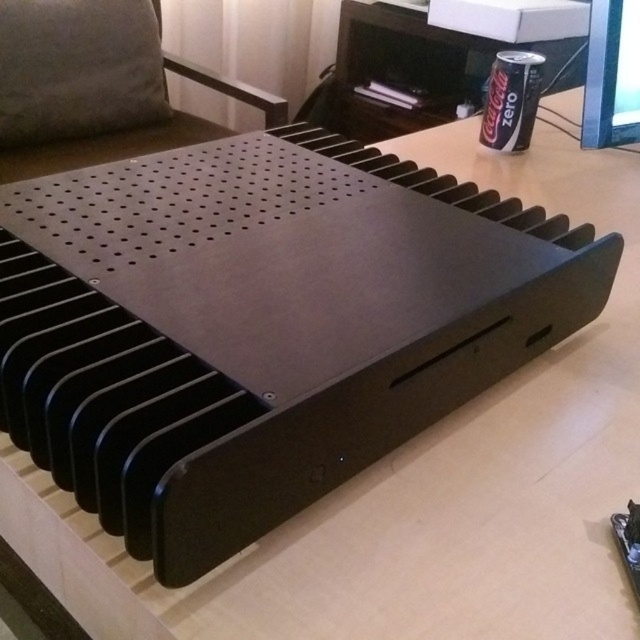
From the picture: Between black matte metal object at center and black matte can at upper right, which one appears on the right side from the viewer's perspective?

From the viewer's perspective, black matte can at upper right appears more on the right side.

Between point (134, 148) and point (532, 102), which one is positioned in front?

Point (532, 102)

The width and height of the screenshot is (640, 640). I want to click on black matte metal object at center, so click(x=100, y=140).

Consider the image. Who is shorter, metallic silver monitor at upper right or black matte can at upper right?

black matte can at upper right

Is point (628, 20) in front of point (496, 145)?

Yes, point (628, 20) is closer to viewer.

Between point (598, 12) and point (520, 132), which one is positioned behind?

The point (520, 132) is more distant.

I want to click on metallic silver monitor at upper right, so click(x=611, y=74).

Between black matte metal object at center and metallic silver monitor at upper right, which one has less height?

Standing shorter between the two is metallic silver monitor at upper right.

In order to click on black matte metal object at center in this screenshot , I will do `click(100, 140)`.